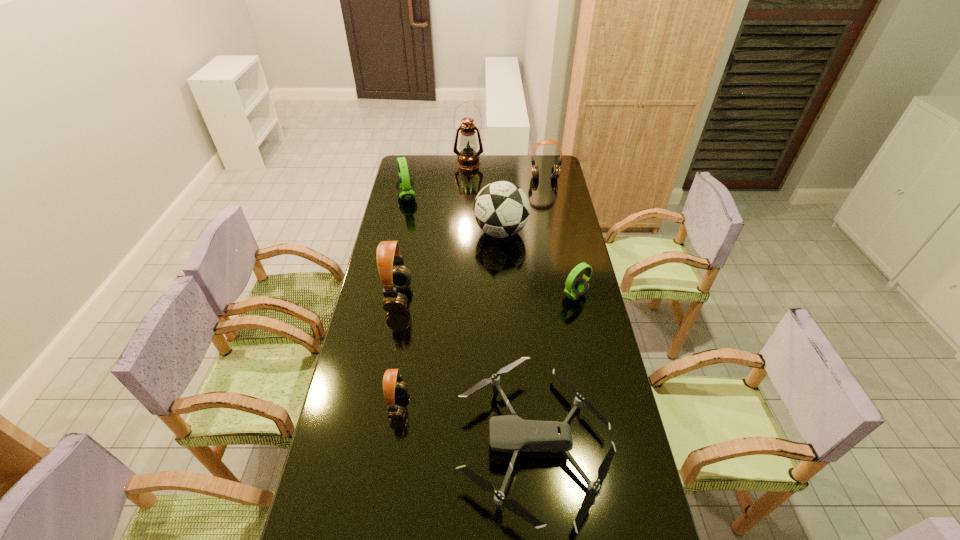
At what (x,y) coordinates should I click in order to perform the action: click on the smaller green headset. Please return your answer as a coordinate pair (x, y). The height and width of the screenshot is (540, 960). Looking at the image, I should click on (574, 288).

Where is `the nearer green headset`? The height and width of the screenshot is (540, 960). the nearer green headset is located at coordinates (574, 288).

At what (x,y) coordinates should I click in order to perform the action: click on the nearest headset. Please return your answer as a coordinate pair (x, y). Looking at the image, I should click on pos(393,386).

In order to click on the smallest brown headset in this screenshot , I will do `click(393, 386)`.

Where is `vacant space located 0.130m on the right of the farthest object`? vacant space located 0.130m on the right of the farthest object is located at coordinates [507, 163].

Locate an element on the screen. blank space located 0.390m on the ear cups of the tallest headset is located at coordinates (513, 299).

Find the location of a particular element. vacant space located on the surface of the black soccer ball where the brand logo is visible is located at coordinates (429, 232).

Where is `free spot located on the surface of the black soccer ball where the brand logo is visible`? The height and width of the screenshot is (540, 960). free spot located on the surface of the black soccer ball where the brand logo is visible is located at coordinates (424, 232).

Locate an element on the screen. This screenshot has height=540, width=960. vacant space situated 0.140m on the surface of the black soccer ball where the brand logo is visible is located at coordinates (443, 232).

Identify the location of free space located 0.300m on the back of the farther green headset. (415, 158).